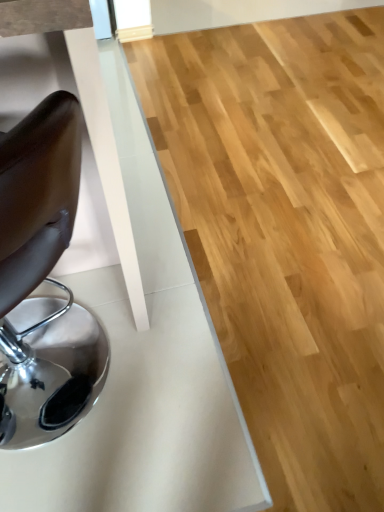
What do you see at coordinates (140, 346) in the screenshot? The image size is (384, 512). I see `white glossy table at center` at bounding box center [140, 346].

I want to click on white glossy table at center, so click(140, 346).

I want to click on white glossy table at center, so click(x=140, y=346).